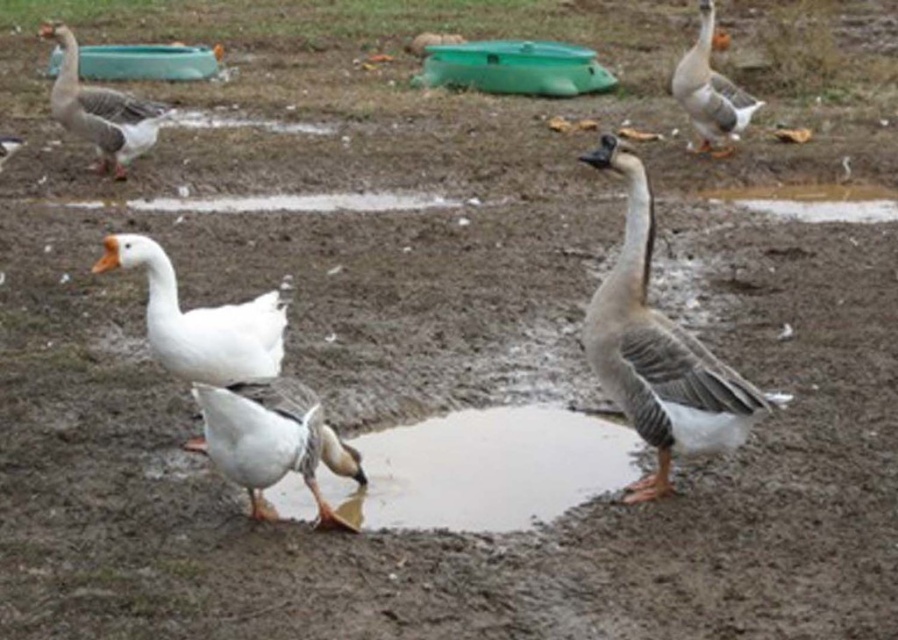
Does gray matte duck at center have a lesser width compared to white matte goose at center?

No, gray matte duck at center is not thinner than white matte goose at center.

Locate an element on the screen. The image size is (898, 640). gray matte duck at center is located at coordinates (658, 349).

Does point (668, 435) lie in front of point (213, 342)?

Yes, point (668, 435) is in front of point (213, 342).

This screenshot has height=640, width=898. I want to click on gray matte duck at center, so click(x=658, y=349).

Identify the location of white matte duck at lower center. The image size is (898, 640). (x=273, y=440).

Does white matte duck at lower center appear under gray matte goose at upper left?

Correct, white matte duck at lower center is located below gray matte goose at upper left.

Find the location of a particular element. white matte duck at lower center is located at coordinates pyautogui.click(x=273, y=440).

Can you confirm if white matte duck at lower center is shorter than white matte goose at center?

No.

Who is positioned more to the right, white matte duck at lower center or white matte goose at center?

white matte duck at lower center is more to the right.

Locate an element on the screen. Image resolution: width=898 pixels, height=640 pixels. white matte duck at lower center is located at coordinates (273, 440).